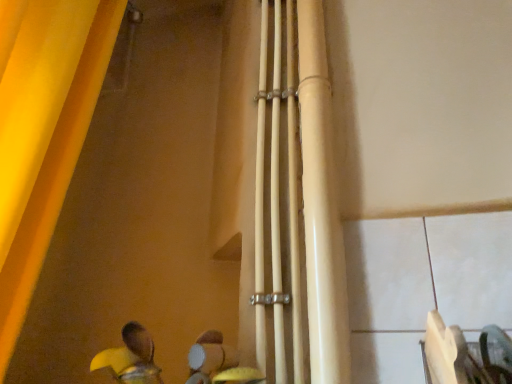
Question: From their relative heights in the image, would you say yellow fabric curtain at left is taller or shorter than matte white pipe at center?

Choices:
 (A) short
 (B) tall

Answer: (B)

Question: Based on their positions, is yellow fabric curtain at left located to the left or right of matte white pipe at center?

Choices:
 (A) left
 (B) right

Answer: (A)

Question: From the image's perspective, is yellow fabric curtain at left located above or below matte white pipe at center?

Choices:
 (A) below
 (B) above

Answer: (B)

Question: Considering their positions, is matte white pipe at center located in front of or behind yellow fabric curtain at left?

Choices:
 (A) front
 (B) behind

Answer: (B)

Question: From their relative heights in the image, would you say matte white pipe at center is taller or shorter than yellow fabric curtain at left?

Choices:
 (A) short
 (B) tall

Answer: (A)

Question: In the image, is matte white pipe at center on the left side or the right side of yellow fabric curtain at left?

Choices:
 (A) left
 (B) right

Answer: (B)

Question: Looking at the image, does matte white pipe at center seem bigger or smaller compared to yellow fabric curtain at left?

Choices:
 (A) big
 (B) small

Answer: (B)